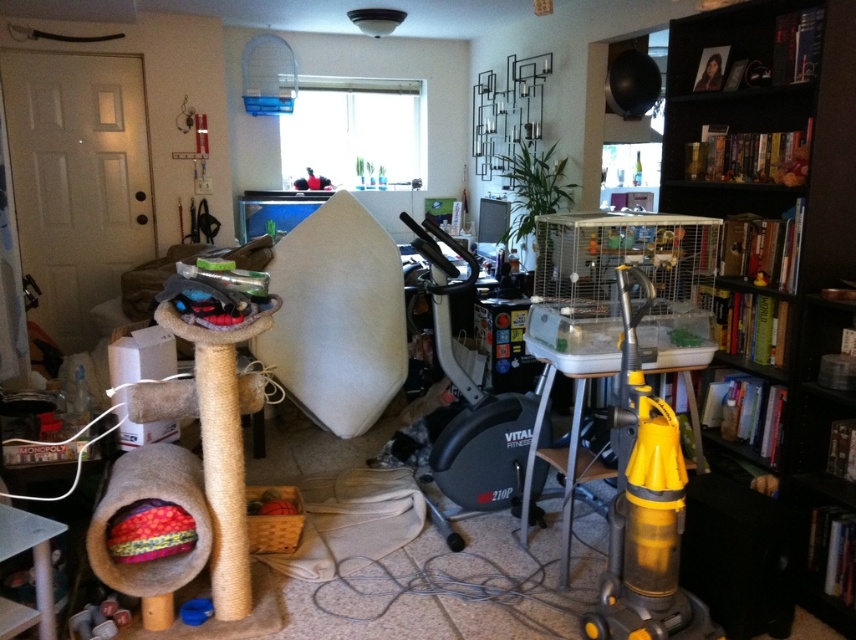
You are standing in the room and want to walk from the cat tree to the vacuum cleaner. Which point, point 1 at coordinates (794, 449) or point 2 at coordinates (629, 529), is closer to your path?

Point 1 at coordinates (794, 449) is closer to your path because it is further to the viewer than point 2 at coordinates (629, 529), meaning it is physically nearer to you as you move from the cat tree to the vacuum cleaner.

You are standing in the living room and want to place a 2.0 meter long sofa against the wall where the black wood bookshelf at right is located. Is there enough space for the sofa to fit alongside the bookshelf?

The distance between you and the black wood bookshelf at right is 2.16 meters. Since the sofa is 2.0 meters long, there is sufficient space for it to fit alongside the bookshelf as the available space is slightly larger than the sofa.